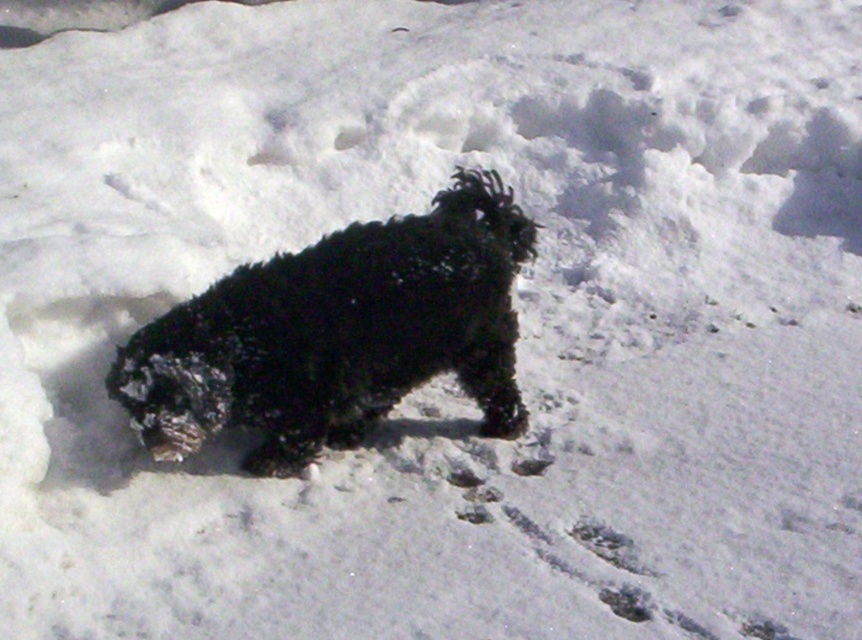
Does black fluffy dog at center appear on the right side of white powdery snow at center?

No, black fluffy dog at center is not to the right of white powdery snow at center.

I want to click on black fluffy dog at center, so click(338, 333).